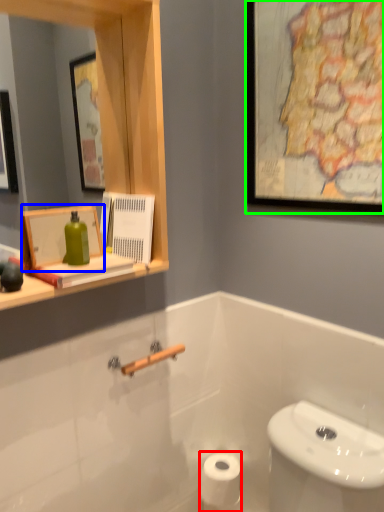
Question: Based on their relative distances, which object is farther from toilet paper (highlighted by a red box)? Choose from picture frame (highlighted by a blue box) and picture frame (highlighted by a green box).

Choices:
 (A) picture frame
 (B) picture frame

Answer: (B)